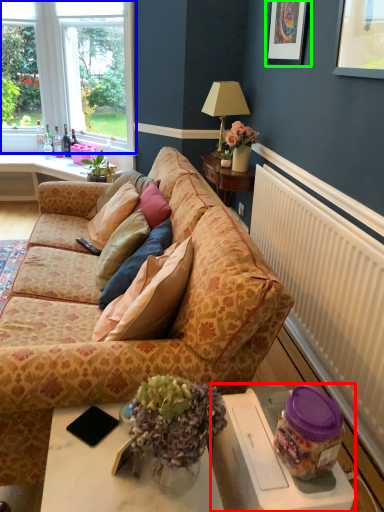
Question: Which object is the closest to the wide (highlighted by a red box)? Choose among these: window (highlighted by a blue box) or picture frame (highlighted by a green box).

Choices:
 (A) window
 (B) picture frame

Answer: (B)